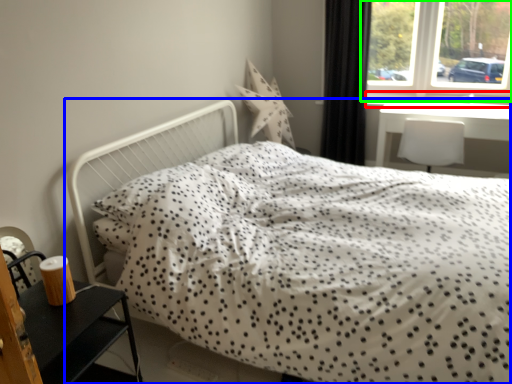
Question: Which object is the farthest from window sill (highlighted by a red box)? Choose among these: bed (highlighted by a blue box) or window (highlighted by a green box).

Choices:
 (A) bed
 (B) window

Answer: (A)